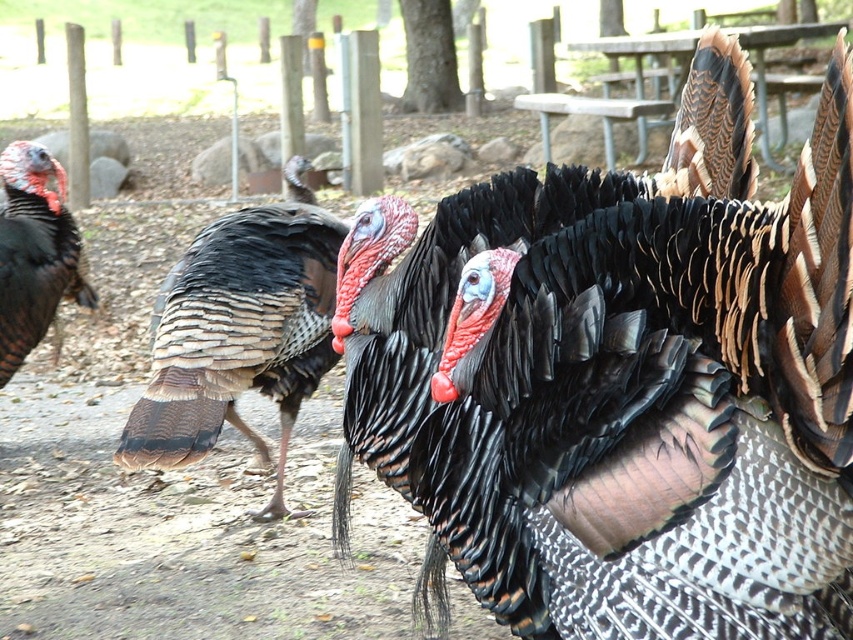
Can you confirm if speckled feathered turkey at center is positioned to the left of matte black turkey at left?

In fact, speckled feathered turkey at center is to the right of matte black turkey at left.

Does point (229, 228) come closer to viewer compared to point (39, 186)?

That is True.

Where is `speckled feathered turkey at center`? The width and height of the screenshot is (853, 640). speckled feathered turkey at center is located at coordinates (238, 333).

Which is more to the left, shiny black feathers at center or matte black turkey at left?

matte black turkey at left is more to the left.

Can you confirm if shiny black feathers at center is positioned above matte black turkey at left?

Actually, shiny black feathers at center is below matte black turkey at left.

Is point (556, 396) closer to viewer compared to point (3, 240)?

Yes.

What are the coordinates of `shiny black feathers at center` in the screenshot? It's located at (630, 385).

Who is more forward, [434,275] or [131,429]?

Point [434,275]

Is shiny black feathers at center below speckled feathered turkey at center?

Actually, shiny black feathers at center is above speckled feathered turkey at center.

Between point (683, 621) and point (183, 392), which one is positioned in front?

Positioned in front is point (683, 621).

Identify the location of shiny black feathers at center. (630, 385).